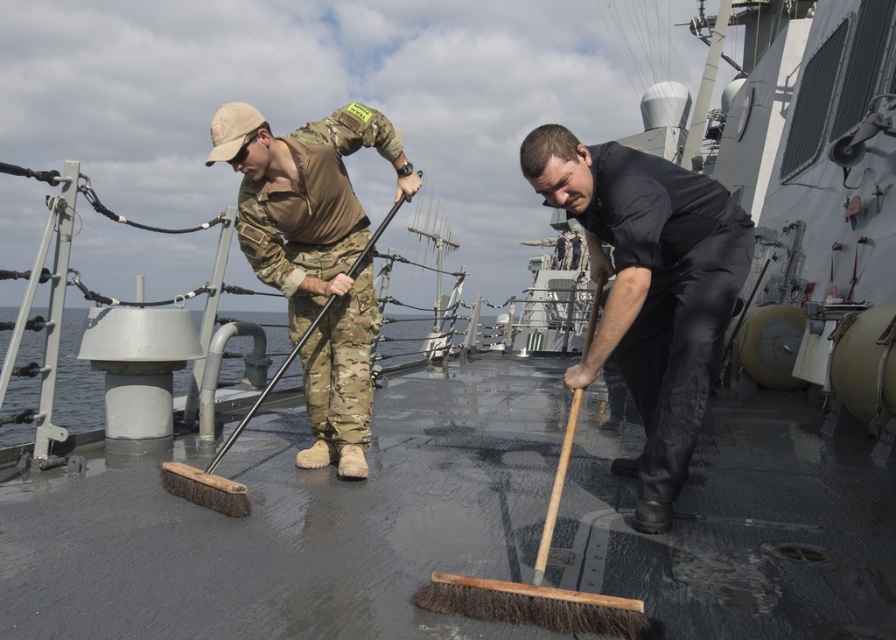
You are a sailor on the ship deck. You see the black matte broom at center and the camouflage fabric uniform at center. Which object is closer to the deck floor?

The black matte broom at center is positioned under the camouflage fabric uniform at center, so it is closer to the deck floor.

You are a sailor on the deck of the ship and need to determine which object is shorter between the black matte broom at center and the camouflage fabric uniform at center. Which one is shorter?

The black matte broom at center is not as tall as the camouflage fabric uniform at center, so the black matte broom at center is shorter.